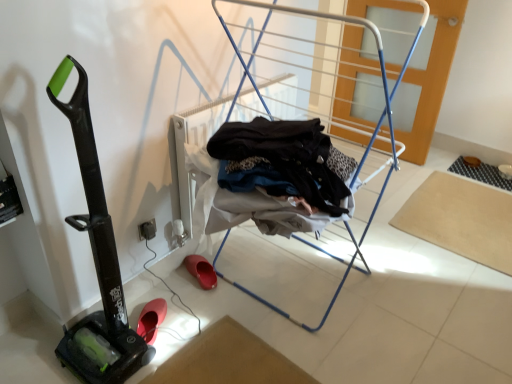
Identify the location of vacant location below metallic blue drying rack at center (from a real-world perspective). This screenshot has width=512, height=384. (290, 274).